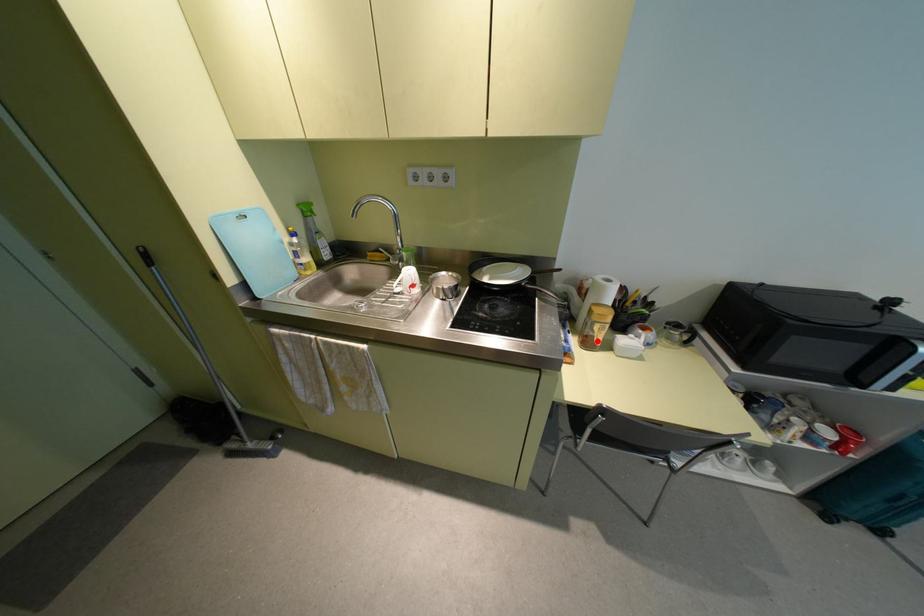
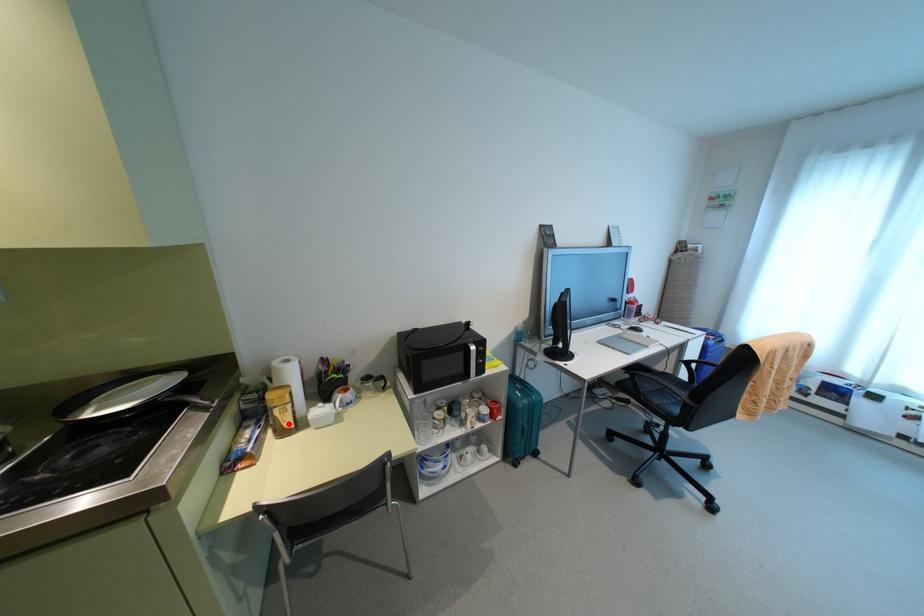
I am providing you with two images of the same scene from different viewpoints. A red point is marked on the first image and another point is marked on the second image. Is the red point in image1 aligned with the point shown in image2?

Yes